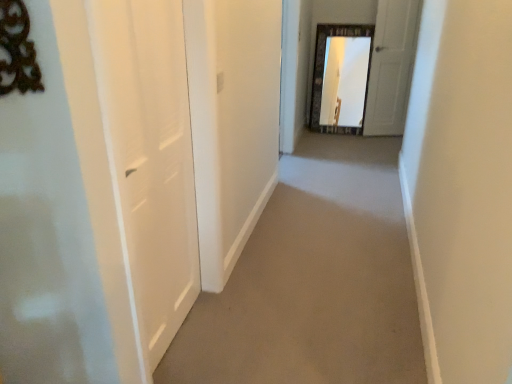
Question: Can you confirm if white matte door at left, which appears as the 1th door when viewed from the left, is positioned to the right of white matte door at upper right, positioned as the second door in left-to-right order?

Choices:
 (A) yes
 (B) no

Answer: (B)

Question: From the image's perspective, is white matte door at left, marked as the first door in a bottom-to-top arrangement, over white matte door at upper right, marked as the first door in a top-to-bottom arrangement?

Choices:
 (A) no
 (B) yes

Answer: (A)

Question: From a real-world perspective, is white matte door at left, the second door from the top, under white matte door at upper right, positioned as the 1th door in back-to-front order?

Choices:
 (A) yes
 (B) no

Answer: (B)

Question: Would you say white matte door at left, marked as the first door in a bottom-to-top arrangement, is a long distance from white matte door at upper right, arranged as the 2th door when viewed from the front?

Choices:
 (A) no
 (B) yes

Answer: (B)

Question: Does white matte door at left, marked as the first door in a bottom-to-top arrangement, touch white matte door at upper right, arranged as the 1th door when viewed from the right?

Choices:
 (A) yes
 (B) no

Answer: (B)

Question: Could you tell me if white matte door at left, which is counted as the second door, starting from the back, is turned towards white matte door at upper right, arranged as the 2th door when viewed from the front?

Choices:
 (A) no
 (B) yes

Answer: (A)

Question: Would you say beige carpet at center is outside white matte door at left, which is the second door in right-to-left order?

Choices:
 (A) yes
 (B) no

Answer: (A)

Question: Is beige carpet at center to the left of white matte door at left, the second door from the top, from the viewer's perspective?

Choices:
 (A) no
 (B) yes

Answer: (A)

Question: Is beige carpet at center next to white matte door at left, which is counted as the second door, starting from the back, and touching it?

Choices:
 (A) no
 (B) yes

Answer: (A)

Question: Does beige carpet at center turn towards white matte door at left, marked as the first door in a bottom-to-top arrangement?

Choices:
 (A) yes
 (B) no

Answer: (B)

Question: Does beige carpet at center appear on the right side of white matte door at left, which is the second door in right-to-left order?

Choices:
 (A) yes
 (B) no

Answer: (A)

Question: Is the depth of beige carpet at center less than that of white matte door at left, which appears as the 1th door when viewed from the left?

Choices:
 (A) no
 (B) yes

Answer: (A)

Question: Considering the relative sizes of beige carpet at center and white matte door at upper right, arranged as the 1th door when viewed from the right, in the image provided, is beige carpet at center shorter than white matte door at upper right, arranged as the 1th door when viewed from the right,?

Choices:
 (A) no
 (B) yes

Answer: (B)